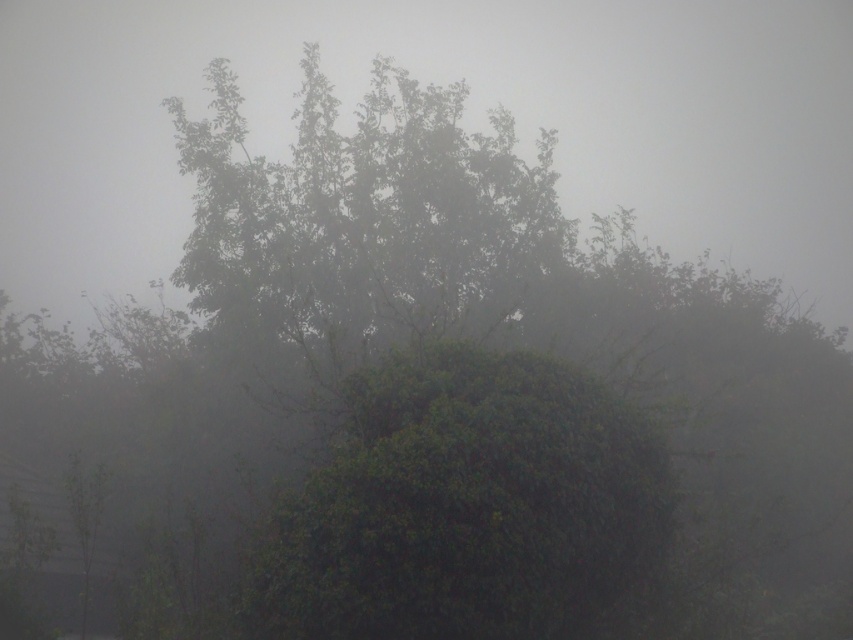
Question: Among these objects, which one is nearest to the camera?

Choices:
 (A) foggy translucent morning fog at upper center
 (B) green leafy bush at center

Answer: (B)

Question: Which point is farther to the camera?

Choices:
 (A) foggy translucent morning fog at upper center
 (B) green leafy bush at center

Answer: (A)

Question: Which of the following is the farthest from the observer?

Choices:
 (A) (596, 404)
 (B) (532, 22)

Answer: (B)

Question: Can you confirm if foggy translucent morning fog at upper center is positioned above green leafy bush at center?

Choices:
 (A) no
 (B) yes

Answer: (B)

Question: Is foggy translucent morning fog at upper center positioned in front of green leafy bush at center?

Choices:
 (A) yes
 (B) no

Answer: (B)

Question: From the image, what is the correct spatial relationship of foggy translucent morning fog at upper center in relation to green leafy bush at center?

Choices:
 (A) above
 (B) below

Answer: (A)